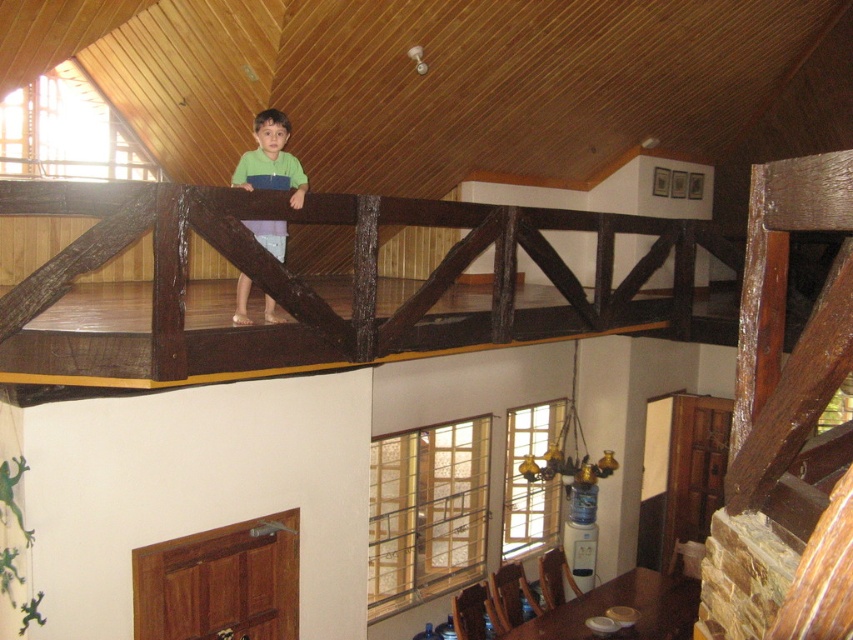
Does dark brown wood at upper center have a larger size compared to green matte shirt at upper center?

Correct, dark brown wood at upper center is larger in size than green matte shirt at upper center.

In the scene shown: Can you confirm if dark brown wood at upper center is thinner than green matte shirt at upper center?

No.

Between point (109, 337) and point (291, 200), which one is positioned behind?

The point (291, 200) is more distant.

Image resolution: width=853 pixels, height=640 pixels. I want to click on dark brown wood at upper center, so click(314, 289).